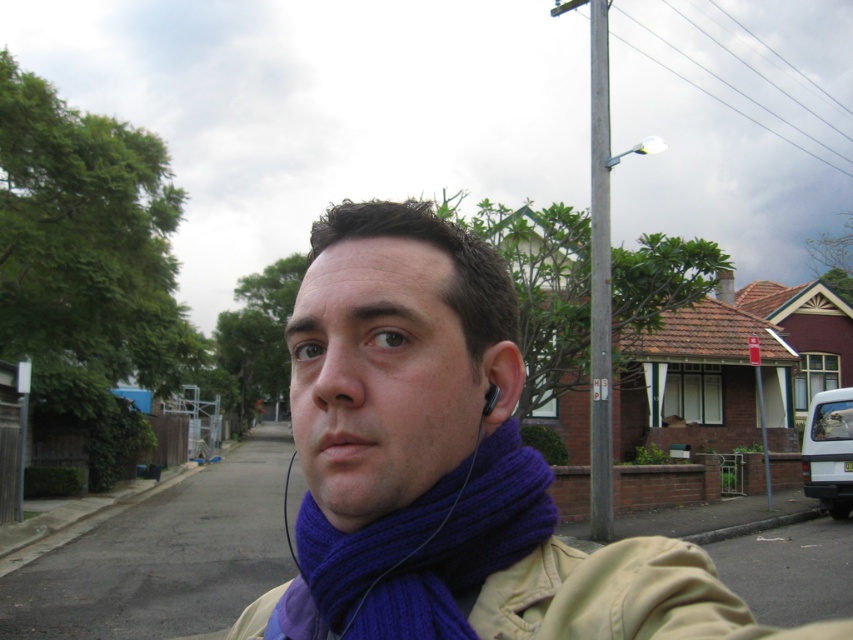
Question: From the image, what is the correct spatial relationship of purple knitted scarf at center in relation to beige/knit jacket at lower center?

Choices:
 (A) left
 (B) right

Answer: (A)

Question: Considering the real-world distances, which object is farthest from the purple knitted scarf at center?

Choices:
 (A) knitted purple scarf at center
 (B) gray metallic pole at upper center

Answer: (B)

Question: Estimate the real-world distances between objects in this image. Which object is farther from the purple knitted scarf at center?

Choices:
 (A) gray metallic pole at upper center
 (B) black matte earphone at ear

Answer: (A)

Question: Does purple knitted scarf at center appear on the left side of black matte earphone at ear?

Choices:
 (A) yes
 (B) no

Answer: (A)

Question: Can you confirm if purple knitted scarf at center is positioned above gray metallic pole at upper center?

Choices:
 (A) no
 (B) yes

Answer: (A)

Question: Which object is farther from the camera taking this photo?

Choices:
 (A) black matte earphone at ear
 (B) purple knitted scarf at center
 (C) beige/knit jacket at lower center

Answer: (C)